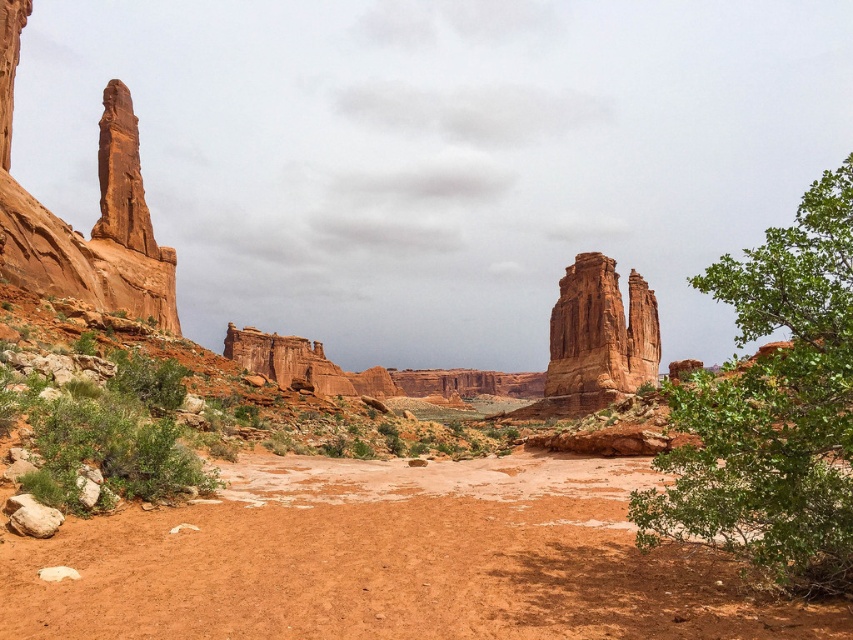
Which is more to the right, dusty red dirt track at center or green leafy tree at right?

Positioned to the right is green leafy tree at right.

The height and width of the screenshot is (640, 853). In order to click on dusty red dirt track at center in this screenshot , I will do `click(392, 560)`.

Does point (450, 563) come farther from viewer compared to point (804, 476)?

Yes.

Locate an element on the screen. This screenshot has height=640, width=853. dusty red dirt track at center is located at coordinates (392, 560).

Is the position of dusty red dirt track at center less distant than that of rustic sandstone rock formation at center?

Yes.

From the picture: Does dusty red dirt track at center appear over rustic sandstone rock formation at center?

Incorrect, dusty red dirt track at center is not positioned above rustic sandstone rock formation at center.

At what (x,y) coordinates should I click in order to perform the action: click on dusty red dirt track at center. Please return your answer as a coordinate pair (x, y). Image resolution: width=853 pixels, height=640 pixels. Looking at the image, I should click on (392, 560).

Is point (770, 518) behind point (140, 429)?

No, (770, 518) is in front of (140, 429).

Where is `green leafy tree at right`? green leafy tree at right is located at coordinates coord(773,408).

At what (x,y) coordinates should I click in order to perform the action: click on green leafy tree at right. Please return your answer as a coordinate pair (x, y). The height and width of the screenshot is (640, 853). Looking at the image, I should click on (773, 408).